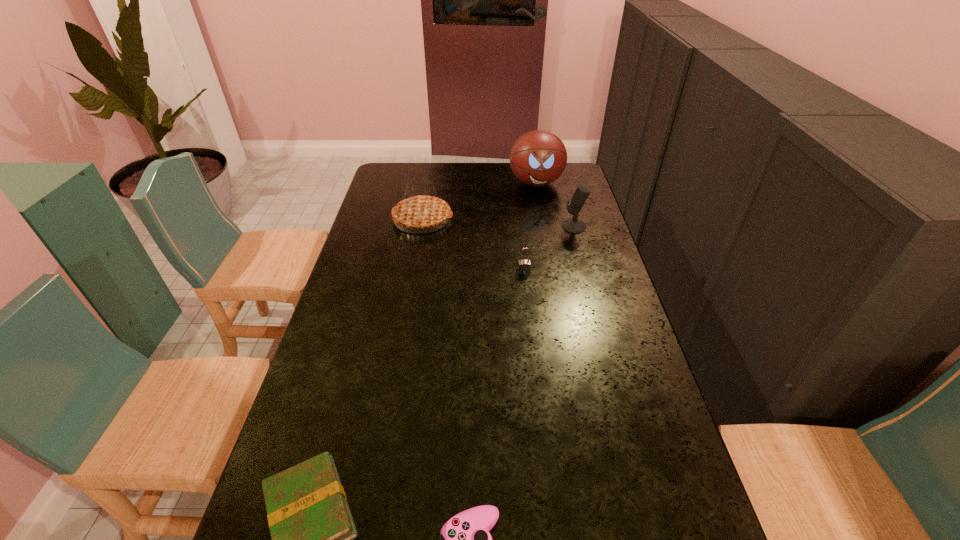
In order to click on object that is at the far edge in this screenshot , I will do `click(538, 158)`.

At what (x,y) coordinates should I click in order to perform the action: click on object that is at the left edge. Please return your answer as a coordinate pair (x, y). The image size is (960, 540). Looking at the image, I should click on (420, 211).

Where is `basketball that is at the right edge`? This screenshot has width=960, height=540. basketball that is at the right edge is located at coordinates (538, 158).

Find the location of a particular element. microphone located at the right edge is located at coordinates (574, 225).

Image resolution: width=960 pixels, height=540 pixels. I want to click on object present at the far right corner, so click(x=538, y=158).

This screenshot has height=540, width=960. I want to click on vacant area at the far edge, so click(516, 185).

Where is `free space at the left edge`? This screenshot has width=960, height=540. free space at the left edge is located at coordinates (382, 251).

Where is `vacant region at the right edge`? The image size is (960, 540). vacant region at the right edge is located at coordinates (562, 195).

The height and width of the screenshot is (540, 960). In the image, there is a desktop. In order to click on free region at the far left corner in this screenshot , I will do `click(383, 174)`.

What are the coordinates of `empty space between the pie and the third nearest object` in the screenshot? It's located at (473, 245).